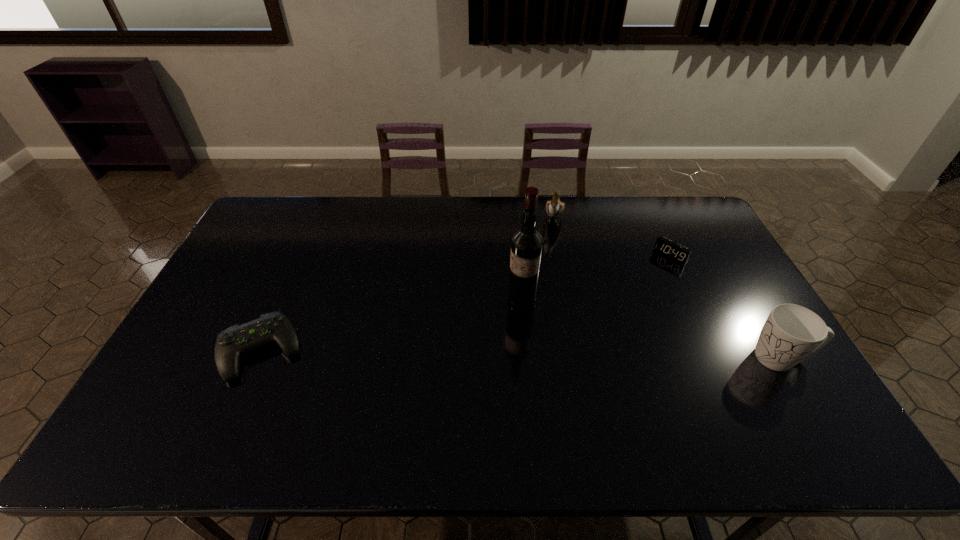
You are a GUI agent. You are given a task and a screenshot of the screen. Output one action in this format:
    pyautogui.click(x=<x>, y=<y>)
    Task: Click on the vacant space on the desktop that is between the leftmost object and the mug and is positioned at the face of the farthest object
    The width and height of the screenshot is (960, 540).
    Given the screenshot: What is the action you would take?
    pyautogui.click(x=516, y=354)

Locate an element on the screen. free space on the desktop that is between the leftmost object and the rightmost object and is positioned on the front-facing side of the fourth object from left to right is located at coordinates (572, 355).

Identify the location of vacant spot on the desktop that is between the control and the rightmost object and is positioned on the front and back of the wine bottle. The image size is (960, 540). (449, 353).